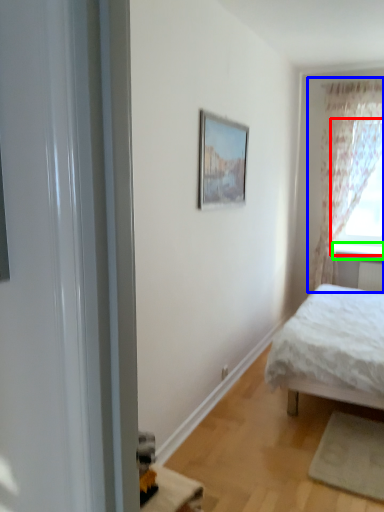
Question: Estimate the real-world distances between objects in this image. Which object is farther from window (highlighted by a red box), curtain (highlighted by a blue box) or window sill (highlighted by a green box)?

Choices:
 (A) curtain
 (B) window sill

Answer: (B)